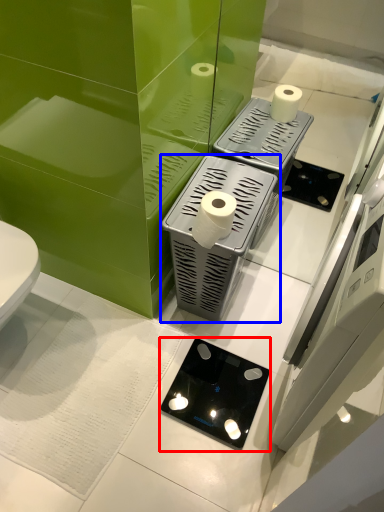
Question: Among these objects, which one is nearest to the camera, appliance (highlighted by a red box) or appliance (highlighted by a blue box)?

Choices:
 (A) appliance
 (B) appliance

Answer: (B)